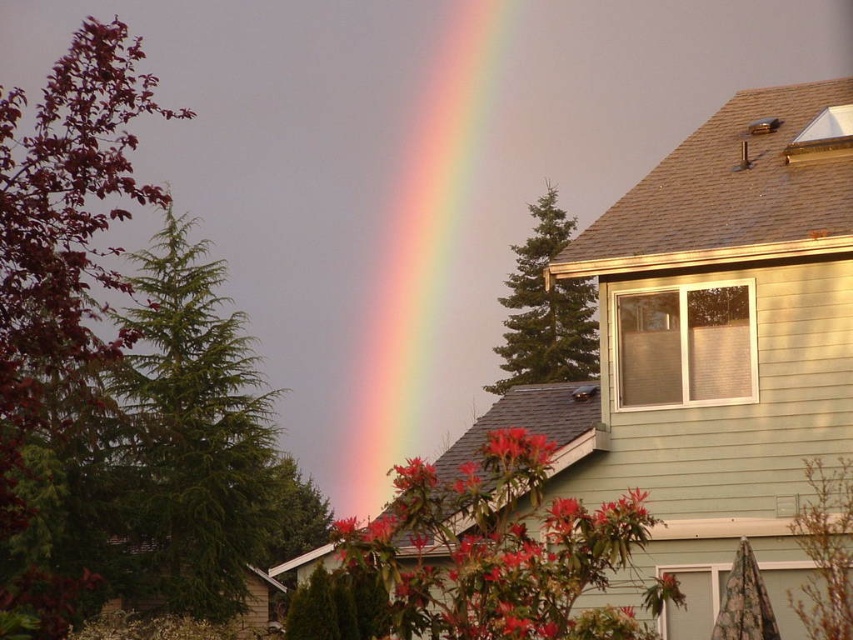
Question: Which object is the farthest from the red matte flower at center?

Choices:
 (A) fluffy pink flower at center
 (B) rainbow at center

Answer: (B)

Question: Which object is closer to the camera taking this photo?

Choices:
 (A) vivid red petals at center
 (B) rainbow at center
 (C) fluffy pink flower at center
 (D) red matte flower at center

Answer: (C)

Question: Is rainbow at center thinner than fluffy pink flower at center?

Choices:
 (A) yes
 (B) no

Answer: (B)

Question: Does rainbow at center lie behind vivid red petals at center?

Choices:
 (A) yes
 (B) no

Answer: (A)

Question: Which of these objects is positioned farthest from the fluffy pink flower at center?

Choices:
 (A) vivid red petals at center
 (B) rainbow at center
 (C) red matte flower at center

Answer: (A)

Question: Does rainbow at center appear under fluffy pink flower at center?

Choices:
 (A) yes
 (B) no

Answer: (B)